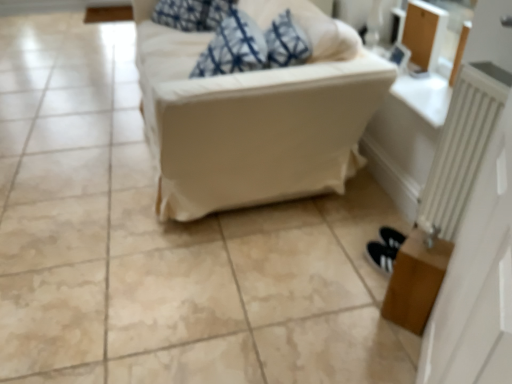
Find the location of a particular element. The width and height of the screenshot is (512, 384). vacant space situated on the left part of white metallic radiator at right is located at coordinates (358, 263).